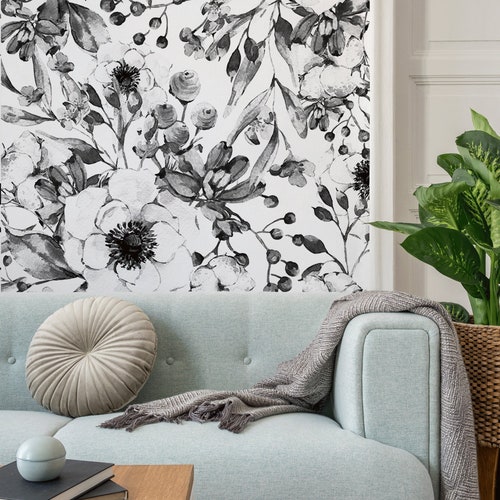
Identify the location of plant. (478, 201).